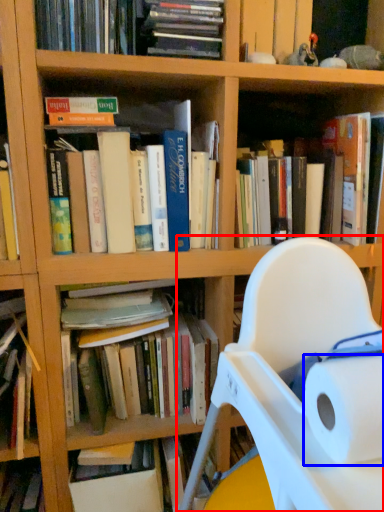
Question: Which object is closer to the camera taking this photo, chair (highlighted by a red box) or paper towel (highlighted by a blue box)?

Choices:
 (A) chair
 (B) paper towel

Answer: (A)